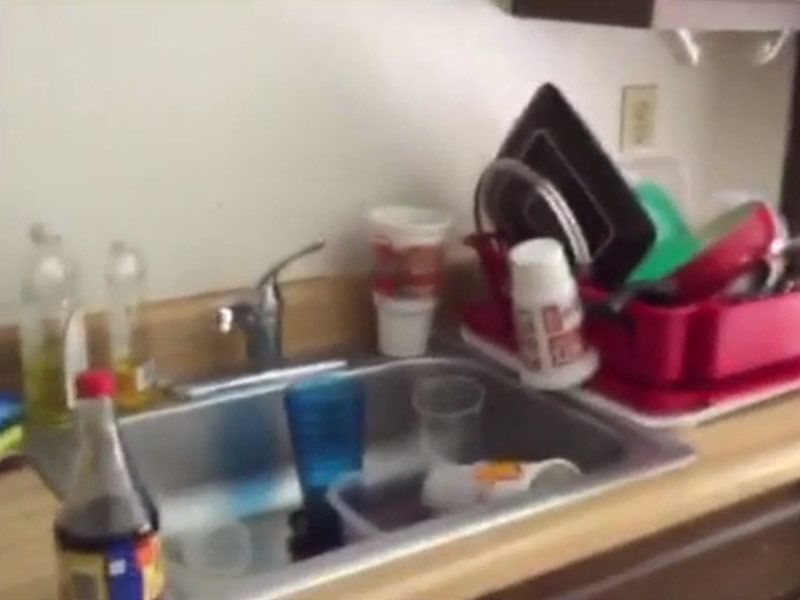
What are the coordinates of `plate` in the screenshot? It's located at (630, 218).